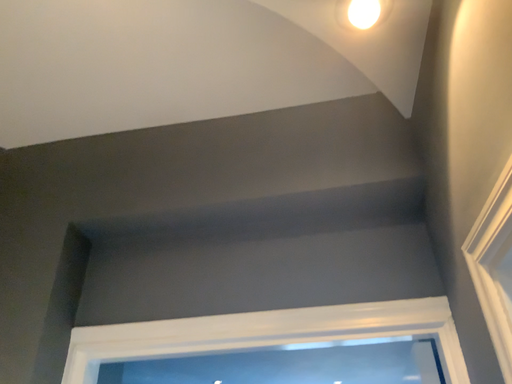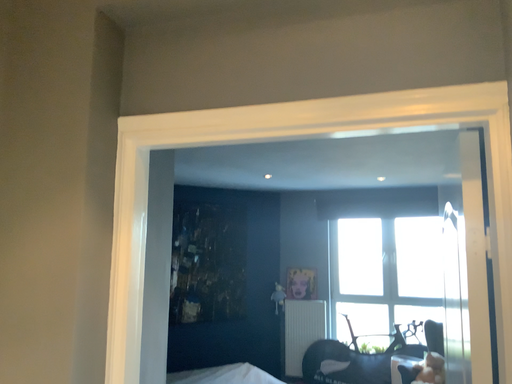
Question: How did the camera likely rotate when shooting the video?

Choices:
 (A) rotated downward
 (B) rotated upward

Answer: (A)